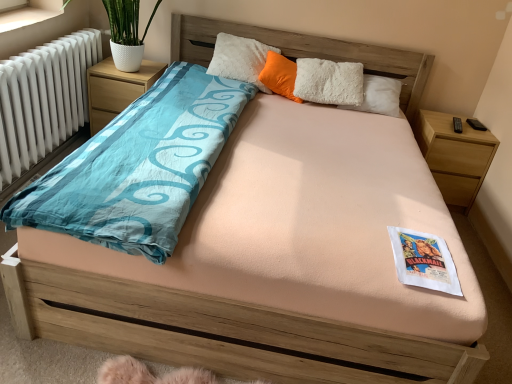
Question: Is orange fluffy pillow at center inside wooden nightstand at right, the 1th nightstand in the right-to-left sequence?

Choices:
 (A) yes
 (B) no

Answer: (B)

Question: Is wooden nightstand at right, the 1th nightstand in the right-to-left sequence, to the right of orange fluffy pillow at center from the viewer's perspective?

Choices:
 (A) yes
 (B) no

Answer: (A)

Question: From a real-world perspective, is wooden nightstand at right, the 1th nightstand in the right-to-left sequence, physically above orange fluffy pillow at center?

Choices:
 (A) yes
 (B) no

Answer: (B)

Question: Considering the relative positions of wooden nightstand at right, the 2th nightstand from the left, and orange fluffy pillow at center in the image provided, is wooden nightstand at right, the 2th nightstand from the left, to the left of orange fluffy pillow at center from the viewer's perspective?

Choices:
 (A) no
 (B) yes

Answer: (A)

Question: Is wooden nightstand at right, the 2th nightstand from the left, oriented away from orange fluffy pillow at center?

Choices:
 (A) yes
 (B) no

Answer: (B)

Question: Considering the relative sizes of wooden nightstand at right, the 2th nightstand from the left, and orange fluffy pillow at center in the image provided, is wooden nightstand at right, the 2th nightstand from the left, bigger than orange fluffy pillow at center?

Choices:
 (A) no
 (B) yes

Answer: (B)

Question: Does white paper at center lie in front of orange fluffy pillow at center?

Choices:
 (A) yes
 (B) no

Answer: (A)

Question: From the image's perspective, is white paper at center beneath orange fluffy pillow at center?

Choices:
 (A) yes
 (B) no

Answer: (A)

Question: Is white paper at center not inside orange fluffy pillow at center?

Choices:
 (A) yes
 (B) no

Answer: (A)

Question: Considering the relative sizes of white paper at center and orange fluffy pillow at center in the image provided, is white paper at center smaller than orange fluffy pillow at center?

Choices:
 (A) no
 (B) yes

Answer: (B)

Question: From a real-world perspective, does white paper at center sit lower than orange fluffy pillow at center?

Choices:
 (A) yes
 (B) no

Answer: (A)

Question: Is white paper at center thinner than orange fluffy pillow at center?

Choices:
 (A) yes
 (B) no

Answer: (B)

Question: From the image's perspective, is wooden nightstand at right, the 2th nightstand from the left, on top of wooden nightstand at left, the 2th nightstand from the right?

Choices:
 (A) no
 (B) yes

Answer: (A)